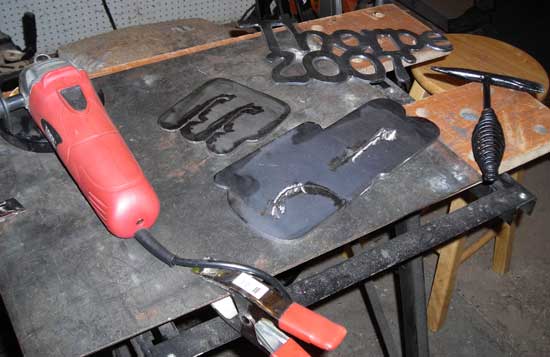
Locate an element on the screen. This screenshot has width=550, height=357. black right table leg is located at coordinates (412, 333).